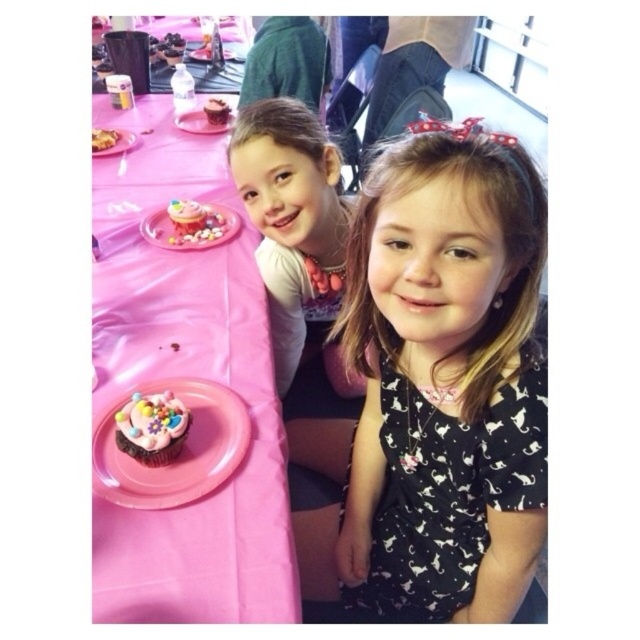
You are a photographer setting up for a birthday party photo. You need to ensure that the pink paper plate at upper center and the matte pink cupcake at center are both visible in the frame. Given their sizes, which object should you position closer to the camera to maintain both in focus?

The pink paper plate at upper center is not as tall as the matte pink cupcake at center. To ensure both are visible and in focus, position the pink paper plate at upper center closer to the camera since it is shorter, allowing the cupcake to still be within the frame while maintaining focus.

You are a photographer at a birthday party and want to capture a closeup of the matte pink cupcake at center and chocolate frosted cake at upper left. Which one is closer to the camera?

The matte pink cupcake at center is closer to the camera because it is positioned over the chocolate frosted cake at upper left.

You are a photographer setting up for a birthday party photo shoot. You need to ensure that the matte pink cupcake at center is visible above the pink paper plate at upper center in the final shot. Based on the scene description, can you confirm if this arrangement is already achieved?

The pink paper plate at upper center is located below the matte pink cupcake at center, so the cupcake is naturally visible above the plate in the current arrangement.